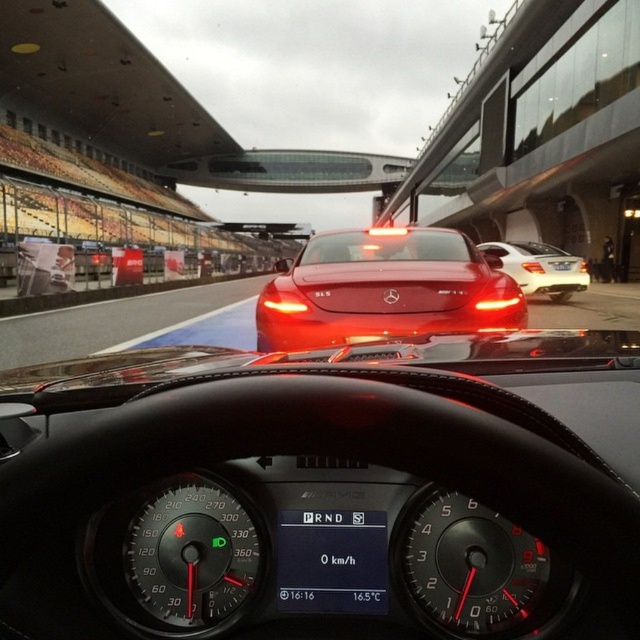
Question: Which point appears farthest from the camera in this image?

Choices:
 (A) (413, 257)
 (B) (524, 259)
 (C) (284, 536)
 (D) (337, 268)

Answer: (B)

Question: Which object is closer to the camera taking this photo?

Choices:
 (A) glossy glass windshield at center
 (B) white plastic license plate at center
 (C) shiny red car at center

Answer: (B)

Question: Does glossy glass windshield at center have a smaller size compared to white glossy sedan at center?

Choices:
 (A) yes
 (B) no

Answer: (A)

Question: Can you confirm if shiny red car at center is positioned below white plastic license plate at center?

Choices:
 (A) yes
 (B) no

Answer: (B)

Question: Which is farther from the glossy glass windshield at center?

Choices:
 (A) white plastic license plate at center
 (B) shiny red car at center

Answer: (A)

Question: Does white plastic license plate at center have a greater width compared to white glossy sedan at center?

Choices:
 (A) yes
 (B) no

Answer: (B)